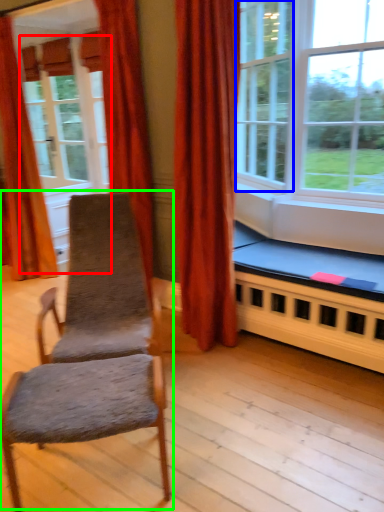
Question: Estimate the real-world distances between objects in this image. Which object is closer to screen door (highlighted by a red box), window (highlighted by a blue box) or rocking chair (highlighted by a green box)?

Choices:
 (A) window
 (B) rocking chair

Answer: (A)